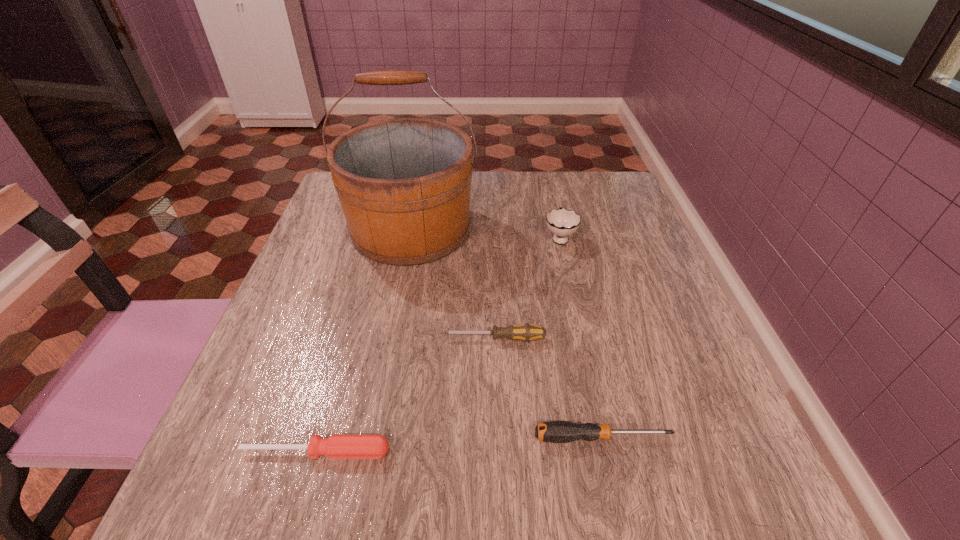
At what (x,y) coordinates should I click in order to perform the action: click on vacant space at the right edge. Please return your answer as a coordinate pair (x, y). The height and width of the screenshot is (540, 960). Looking at the image, I should click on (654, 352).

This screenshot has height=540, width=960. Identify the location of vacant area that lies between the tallest object and the third nearest object. (452, 284).

Find the location of a particular element. This screenshot has width=960, height=540. unoccupied position between the leftmost screwdriver and the fourth shortest object is located at coordinates (438, 345).

The image size is (960, 540). Find the location of `free space that is in between the third farthest object and the fourth shortest object`. free space that is in between the third farthest object and the fourth shortest object is located at coordinates (527, 288).

The width and height of the screenshot is (960, 540). I want to click on free space between the bucket and the cup, so click(485, 233).

This screenshot has height=540, width=960. Identify the location of vacant space that is in between the bucket and the farthest screwdriver. (452, 284).

I want to click on free space between the bucket and the leftmost screwdriver, so click(364, 340).

Where is `object that ranks as the second closest to the tallest object`? This screenshot has height=540, width=960. object that ranks as the second closest to the tallest object is located at coordinates (526, 332).

This screenshot has height=540, width=960. What are the coordinates of `object that is the nearest to the leftmost screwdriver` in the screenshot? It's located at coord(526,332).

Find the location of `the closest screwdriver to the bucket`. the closest screwdriver to the bucket is located at coordinates (526, 332).